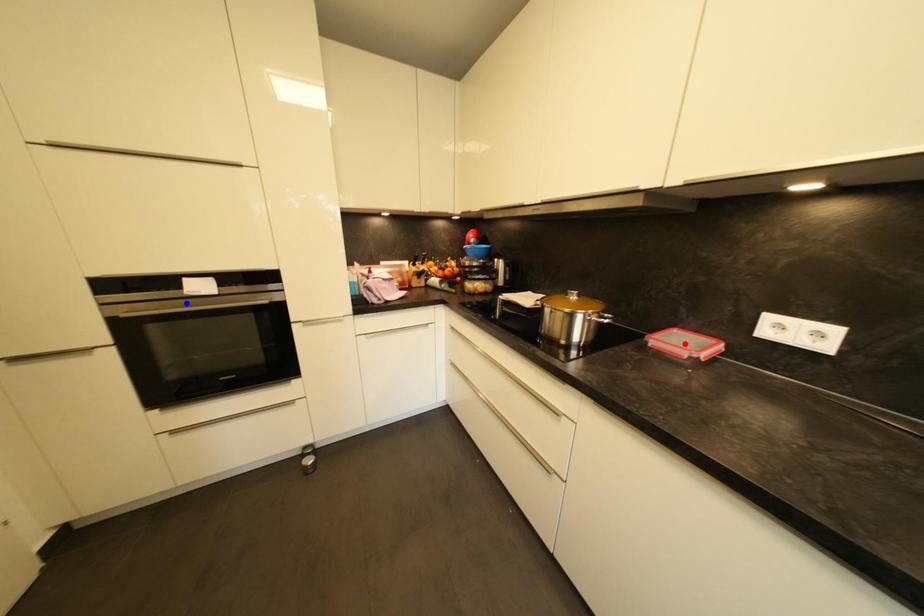
Question: Which of the two points in the image is closer to the camera?

Choices:
 (A) Blue point is closer.
 (B) Red point is closer.

Answer: (B)